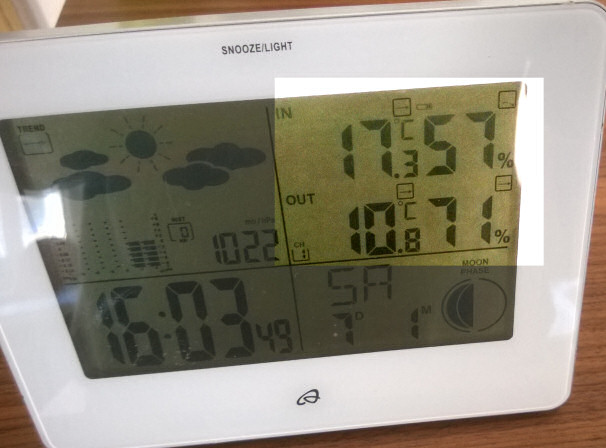
In order to click on thermostat in this screenshot , I will do `click(519, 51)`.